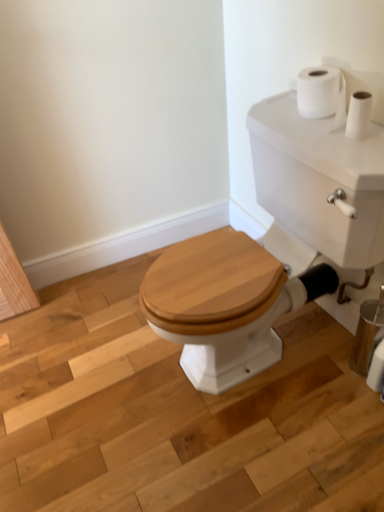
Question: Relative to white matte toilet paper at upper right, the first toilet paper positioned from the left, is wooden toilet seat at center in front or behind?

Choices:
 (A) front
 (B) behind

Answer: (A)

Question: From the image's perspective, relative to white matte toilet paper at upper right, acting as the second toilet paper starting from the right, is wooden toilet seat at center above or below?

Choices:
 (A) below
 (B) above

Answer: (A)

Question: Which object is the farthest from the wooden toilet seat at center?

Choices:
 (A) white glossy porcelain at center
 (B) white matte toilet paper at upper right, marked as the 2th toilet paper in a left-to-right arrangement
 (C) white matte toilet paper at upper right, the first toilet paper positioned from the left

Answer: (C)

Question: Which of these objects is positioned farthest from the white glossy porcelain at center?

Choices:
 (A) white matte toilet paper at upper right, the first toilet paper when ordered from bottom to top
 (B) white matte toilet paper at upper right, the second toilet paper in the bottom-to-top sequence
 (C) wooden toilet seat at center

Answer: (A)